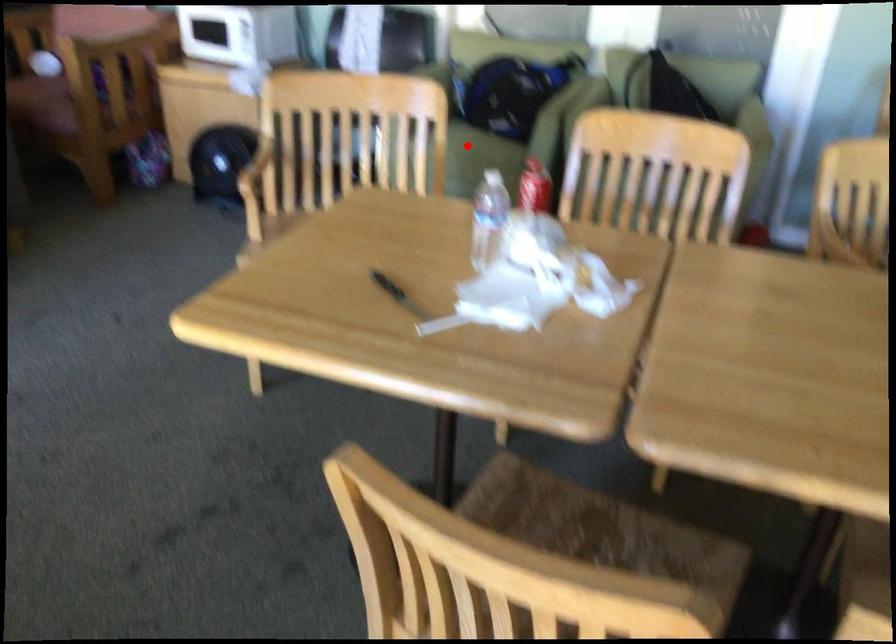
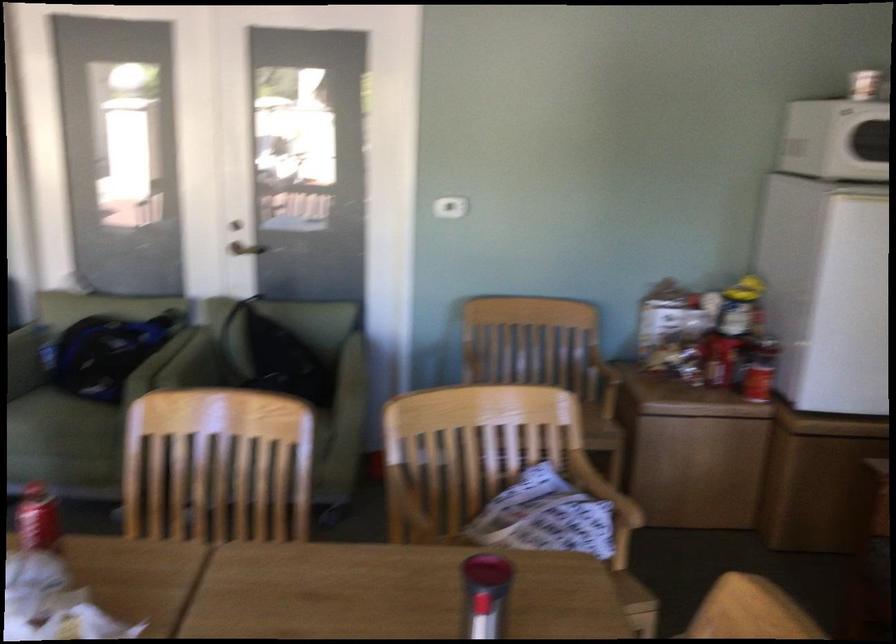
Locate, in the second image, the point that corresponds to the highlighted location in the first image.

(61, 424)